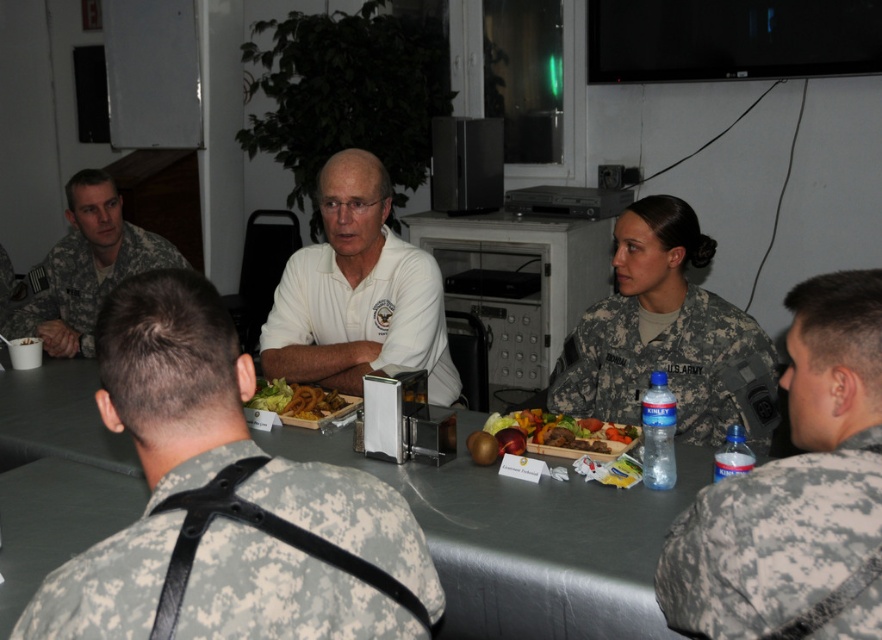
Who is more distant from viewer, (219, 525) or (833, 554)?

Positioned behind is point (833, 554).

Can you confirm if camouflage fabric harness at lower left is wider than camouflage fabric uniform at lower right?

Yes.

Who is more distant from viewer, (168, 474) or (797, 524)?

Positioned behind is point (797, 524).

I want to click on camouflage fabric harness at lower left, so click(280, 593).

Consider the image. Can you confirm if camouflage fabric harness at lower left is positioned above camouflage fabric uniform at left?

No.

Locate an element on the screen. camouflage fabric harness at lower left is located at coordinates (280, 593).

You are a GUI agent. You are given a task and a screenshot of the screen. Output one action in this format:
    pyautogui.click(x=<x>, y=<y>)
    Task: Click on the camouflage fabric harness at lower left
    The width and height of the screenshot is (882, 640).
    Given the screenshot: What is the action you would take?
    pyautogui.click(x=280, y=593)

Which is in front, point (587, 387) or point (607, 444)?

Point (607, 444)

This screenshot has width=882, height=640. What do you see at coordinates (671, 369) in the screenshot?
I see `camouflage fabric uniform at center` at bounding box center [671, 369].

Identify the location of camouflage fabric uniform at center. Image resolution: width=882 pixels, height=640 pixels. (671, 369).

The width and height of the screenshot is (882, 640). I want to click on camouflage fabric uniform at center, so click(x=671, y=369).